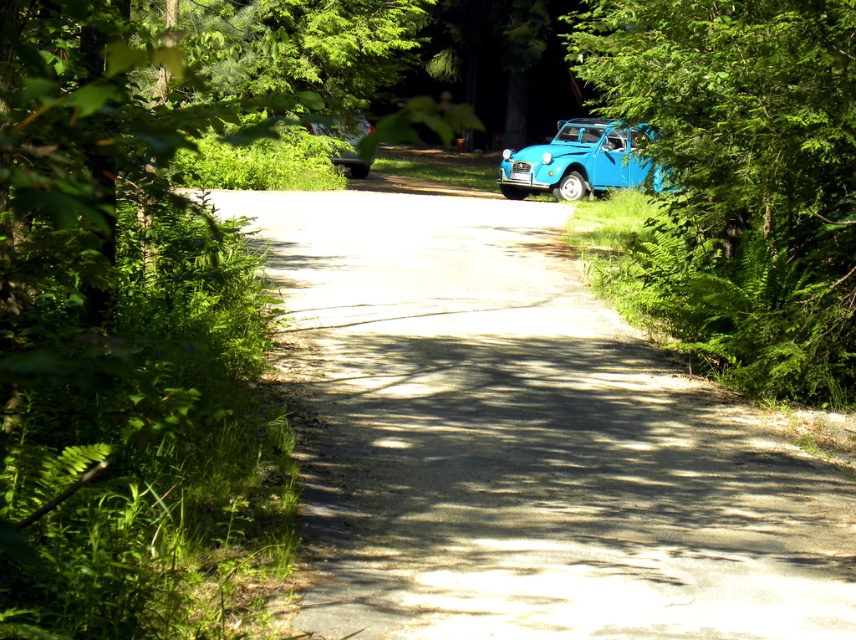
Question: Which point appears closest to the camera in this image?

Choices:
 (A) (828, 360)
 (B) (542, 173)

Answer: (A)

Question: Where is green leafy tree at right located in relation to metallic silver car at center in the image?

Choices:
 (A) above
 (B) below

Answer: (A)

Question: Which object is positioned farthest from the metallic silver car at center?

Choices:
 (A) smooth asphalt driveway at center
 (B) blue matte car at right
 (C) green leafy tree at right

Answer: (A)

Question: Which point is closer to the camera?

Choices:
 (A) metallic silver car at center
 (B) blue matte car at right
 (C) smooth asphalt driveway at center

Answer: (C)

Question: Can you confirm if green leafy tree at right is positioned to the left of metallic silver car at center?

Choices:
 (A) no
 (B) yes

Answer: (A)

Question: Is green leafy tree at right to the right of blue matte car at right from the viewer's perspective?

Choices:
 (A) yes
 (B) no

Answer: (A)